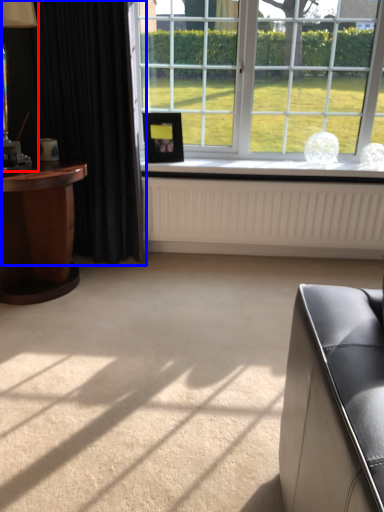
Question: Among these objects, which one is nearest to the camera, table lamp (highlighted by a red box) or curtain (highlighted by a blue box)?

Choices:
 (A) table lamp
 (B) curtain

Answer: (A)